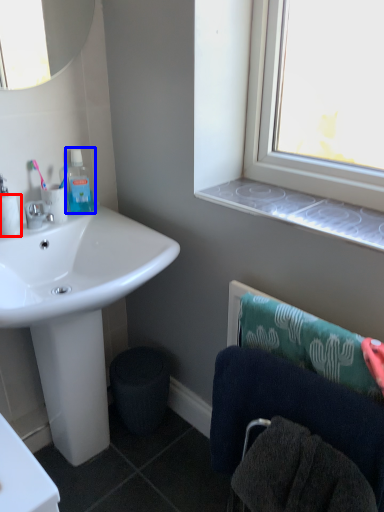
Question: Among these objects, which one is nearest to the camera, toilet paper (highlighted by a red box) or mouthwash (highlighted by a blue box)?

Choices:
 (A) toilet paper
 (B) mouthwash

Answer: (A)